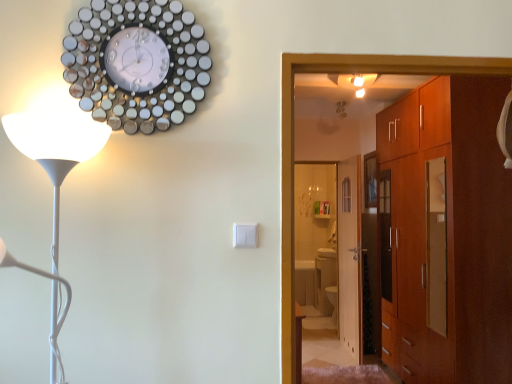
This screenshot has height=384, width=512. In order to click on white glossy floor lamp at left in this screenshot , I will do `click(56, 148)`.

The image size is (512, 384). Describe the element at coordinates (446, 233) in the screenshot. I see `matte brown cabinet at right` at that location.

The width and height of the screenshot is (512, 384). In order to click on matte brown cabinet at right in this screenshot , I will do `click(446, 233)`.

Measure the distance between wooden door at center and camera.

The distance of wooden door at center from camera is 13.34 feet.

Locate an element on the screen. The image size is (512, 384). wooden door at center is located at coordinates (350, 256).

This screenshot has width=512, height=384. Find the location of `white glossy floor lamp at left`. white glossy floor lamp at left is located at coordinates (56, 148).

From the image's perspective, which is below, wooden door at center or matte brown cabinet at right?

wooden door at center, from the image's perspective.

Can you confirm if wooden door at center is shorter than matte brown cabinet at right?

Yes, wooden door at center is shorter than matte brown cabinet at right.

Can you see wooden door at center touching matte brown cabinet at right?

No, wooden door at center is not in contact with matte brown cabinet at right.

Which is correct: wooden door at center is inside matte brown cabinet at right, or outside of it?

wooden door at center is not enclosed by matte brown cabinet at right.

In terms of height, does white glossy floor lamp at left look taller or shorter compared to metallic circular clock at upper left?

In the image, white glossy floor lamp at left appears to be taller than metallic circular clock at upper left.

Can you tell me how much white glossy floor lamp at left and metallic circular clock at upper left differ in facing direction?

They differ by 0.511 degrees in their facing directions.

Considering the relative sizes of white glossy floor lamp at left and metallic circular clock at upper left in the image provided, is white glossy floor lamp at left wider than metallic circular clock at upper left?

Yes, white glossy floor lamp at left is wider than metallic circular clock at upper left.

From the image's perspective, is white glossy floor lamp at left located above metallic circular clock at upper left?

No, from the image's perspective, white glossy floor lamp at left is not on top of metallic circular clock at upper left.

From the image's perspective, is matte brown cabinet at right located above metallic circular clock at upper left?

No.

Is matte brown cabinet at right bigger than metallic circular clock at upper left?

Correct, matte brown cabinet at right is larger in size than metallic circular clock at upper left.

Is matte brown cabinet at right positioned beyond the bounds of metallic circular clock at upper left?

Absolutely, matte brown cabinet at right is external to metallic circular clock at upper left.

Considering the relative sizes of wooden door at center and white glossy floor lamp at left in the image provided, is wooden door at center wider than white glossy floor lamp at left?

Incorrect, the width of wooden door at center does not surpass that of white glossy floor lamp at left.

Is wooden door at center facing towards white glossy floor lamp at left?

No, wooden door at center is not oriented towards white glossy floor lamp at left.

Consider the image. Is wooden door at center bigger or smaller than white glossy floor lamp at left?

wooden door at center is bigger than white glossy floor lamp at left.

The width and height of the screenshot is (512, 384). Identify the location of lamp lying above the wooden door at center (from the image's perspective). (56, 148).

In terms of height, does matte brown cabinet at right look taller or shorter compared to white glossy floor lamp at left?

Considering their sizes, matte brown cabinet at right has more height than white glossy floor lamp at left.

From the image's perspective, which object appears higher, matte brown cabinet at right or white glossy floor lamp at left?

From the image's view, white glossy floor lamp at left is above.

How different are the orientations of matte brown cabinet at right and white glossy floor lamp at left in degrees?

They differ by 91.5 degrees in their facing directions.

Can you confirm if matte brown cabinet at right is bigger than white glossy floor lamp at left?

Indeed, matte brown cabinet at right has a larger size compared to white glossy floor lamp at left.

Considering the relative positions of wooden door at center and metallic circular clock at upper left in the image provided, is wooden door at center behind metallic circular clock at upper left?

Yes, wooden door at center is behind metallic circular clock at upper left.

Is wooden door at center far from metallic circular clock at upper left?

wooden door at center is positioned a significant distance from metallic circular clock at upper left.

From a real-world perspective, is wooden door at center positioned under metallic circular clock at upper left based on gravity?

Yes.

Looking at the image, does wooden door at center seem bigger or smaller compared to metallic circular clock at upper left?

In the image, wooden door at center appears to be larger than metallic circular clock at upper left.

Is metallic circular clock at upper left not near white glossy floor lamp at left?

That's not correct — metallic circular clock at upper left is a little close to white glossy floor lamp at left.

Looking at this image, is white glossy floor lamp at left at the back of metallic circular clock at upper left?

No, metallic circular clock at upper left's orientation is not away from white glossy floor lamp at left.

From the image's perspective, would you say metallic circular clock at upper left is positioned over white glossy floor lamp at left?

Indeed, from the image's perspective, metallic circular clock at upper left is shown above white glossy floor lamp at left.

Is the position of metallic circular clock at upper left more distant than that of white glossy floor lamp at left?

Yes.

Where is `door on the left side of matte brown cabinet at right`? door on the left side of matte brown cabinet at right is located at coordinates (350, 256).

Image resolution: width=512 pixels, height=384 pixels. Identify the location of lamp located below the metallic circular clock at upper left (from the image's perspective). (56, 148).

Considering their positions, is matte brown cabinet at right positioned closer to wooden door at center than white glossy floor lamp at left?

matte brown cabinet at right.

From the image, which object appears to be farther from wooden door at center, metallic circular clock at upper left or white glossy floor lamp at left?

white glossy floor lamp at left.

Looking at the image, which one is located further to matte brown cabinet at right, metallic circular clock at upper left or wooden door at center?

metallic circular clock at upper left.

When comparing their distances from matte brown cabinet at right, does wooden door at center or metallic circular clock at upper left seem further?

metallic circular clock at upper left.

Looking at the image, which one is located further to metallic circular clock at upper left, white glossy floor lamp at left or wooden door at center?

wooden door at center is positioned further to the anchor metallic circular clock at upper left.

Considering their positions, is wooden door at center positioned further to white glossy floor lamp at left than metallic circular clock at upper left?

wooden door at center.

Considering their positions, is matte brown cabinet at right positioned closer to white glossy floor lamp at left than wooden door at center?

Among the two, matte brown cabinet at right is located nearer to white glossy floor lamp at left.

Based on the photo, based on their spatial positions, is matte brown cabinet at right or metallic circular clock at upper left further from wooden door at center?

Among the two, metallic circular clock at upper left is located further to wooden door at center.

Locate an element on the screen. wall clock between white glossy floor lamp at left and wooden door at center from front to back is located at coordinates (136, 63).

Identify the location of cabinetry located between metallic circular clock at upper left and wooden door at center in the depth direction. Image resolution: width=512 pixels, height=384 pixels. (446, 233).

Where is `wall clock between white glossy floor lamp at left and matte brown cabinet at right`? The image size is (512, 384). wall clock between white glossy floor lamp at left and matte brown cabinet at right is located at coordinates (136, 63).

The height and width of the screenshot is (384, 512). I want to click on cabinetry between white glossy floor lamp at left and wooden door at center from front to back, so click(x=446, y=233).